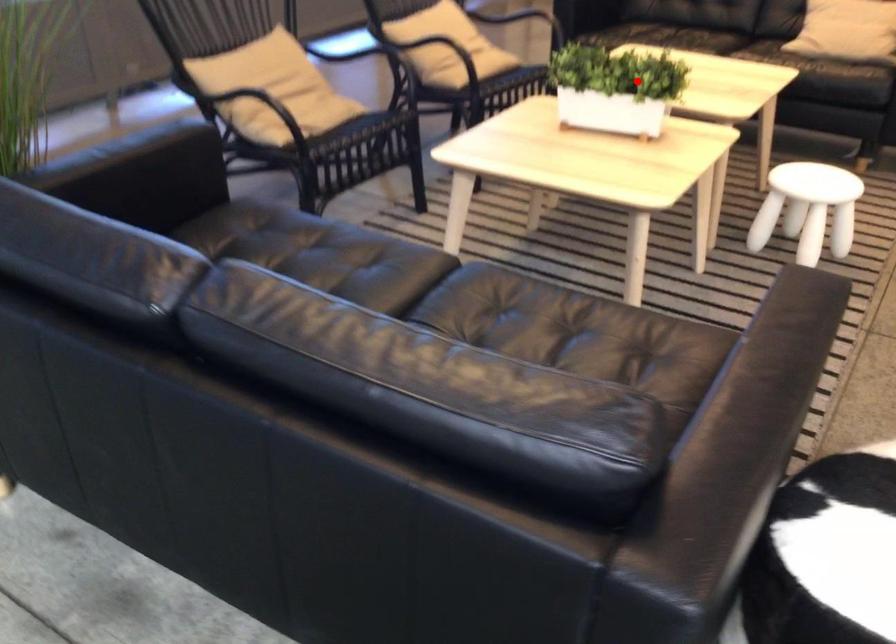
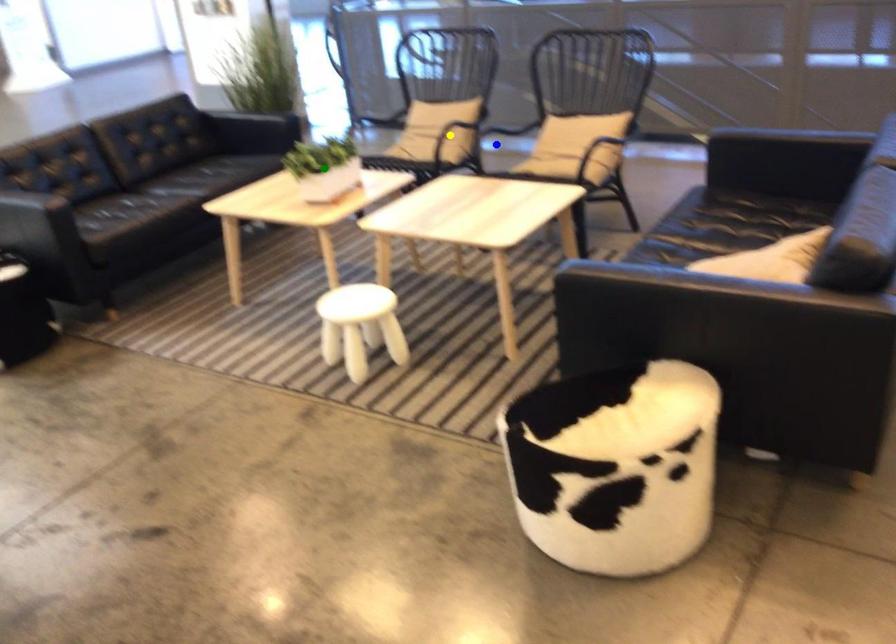
Question: I am providing you with two images of the same scene from different viewpoints. A red point is marked on the first image. You are given multiple points on the second image. Which point in image 2 represents the same 3d spot as the red point in image 1?

Choices:
 (A) green point
 (B) blue point
 (C) yellow point

Answer: (A)